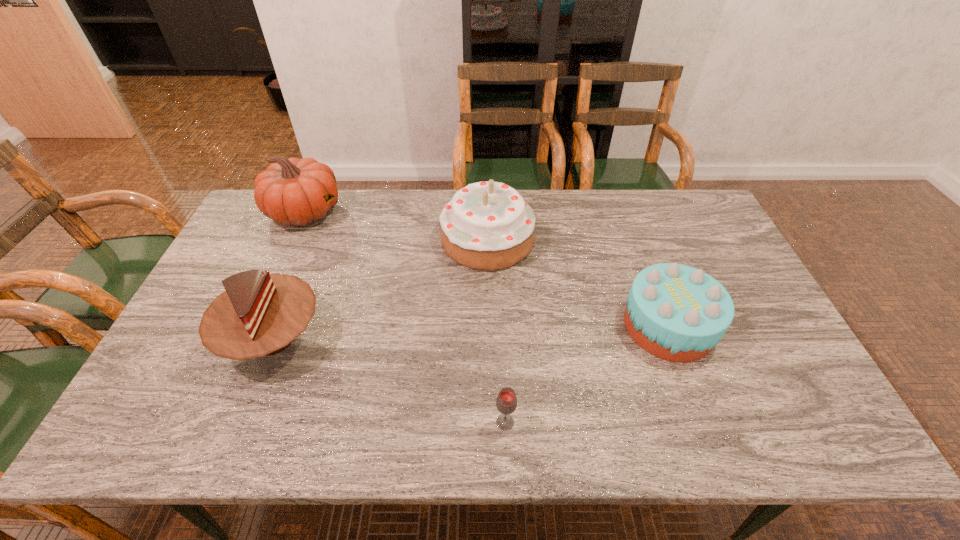
Find the location of a particular element. free location that satisfies the following two spatial constraints: 1. on the front side of the leftmost cake; 2. on the right side of the glass drink container is located at coordinates (239, 422).

Identify the location of free location that satisfies the following two spatial constraints: 1. on the back side of the shortest object; 2. on the left side of the rightmost object. The width and height of the screenshot is (960, 540). (501, 326).